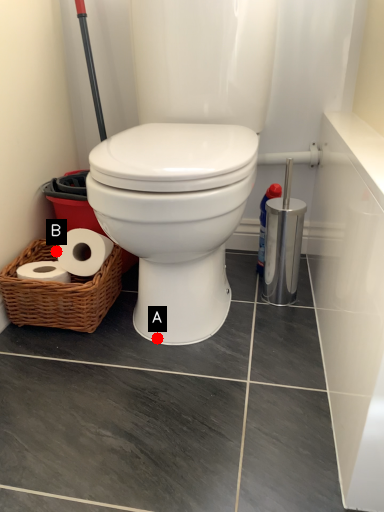
Question: Two points are circled on the image, labeled by A and B beside each circle. Among these points, which one is nearest to the camera?

Choices:
 (A) A is closer
 (B) B is closer

Answer: (A)